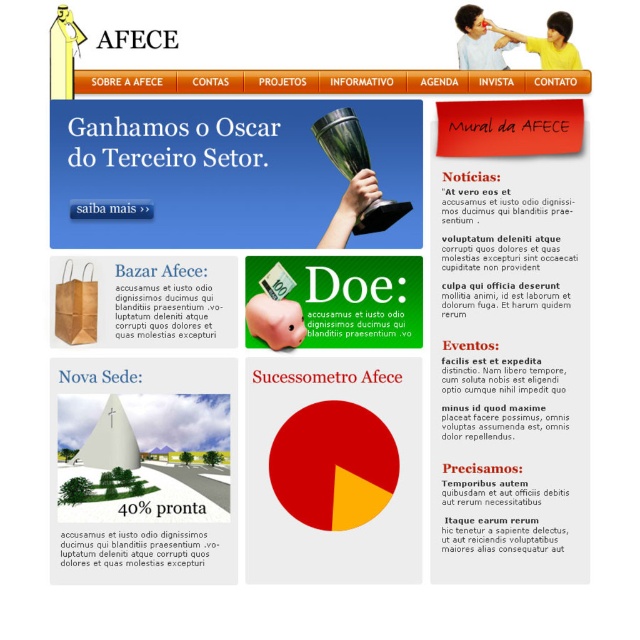
Question: Which point is closer to the camera?

Choices:
 (A) green paper bag at left
 (B) black paper at upper center

Answer: (B)

Question: Does green paper bag at left have a larger size compared to black paper at upper center?

Choices:
 (A) no
 (B) yes

Answer: (B)

Question: Which point appears farthest from the camera in this image?

Choices:
 (A) (202, 552)
 (B) (161, 292)

Answer: (B)

Question: Which point is farther from the camera taking this photo?

Choices:
 (A) (216, 333)
 (B) (141, 545)
 (C) (518, 353)

Answer: (A)

Question: Is black paper at upper right to the left of green paper bag at left from the viewer's perspective?

Choices:
 (A) yes
 (B) no

Answer: (B)

Question: In this image, where is black paper at upper right located relative to black paper at upper center?

Choices:
 (A) above
 (B) below

Answer: (A)